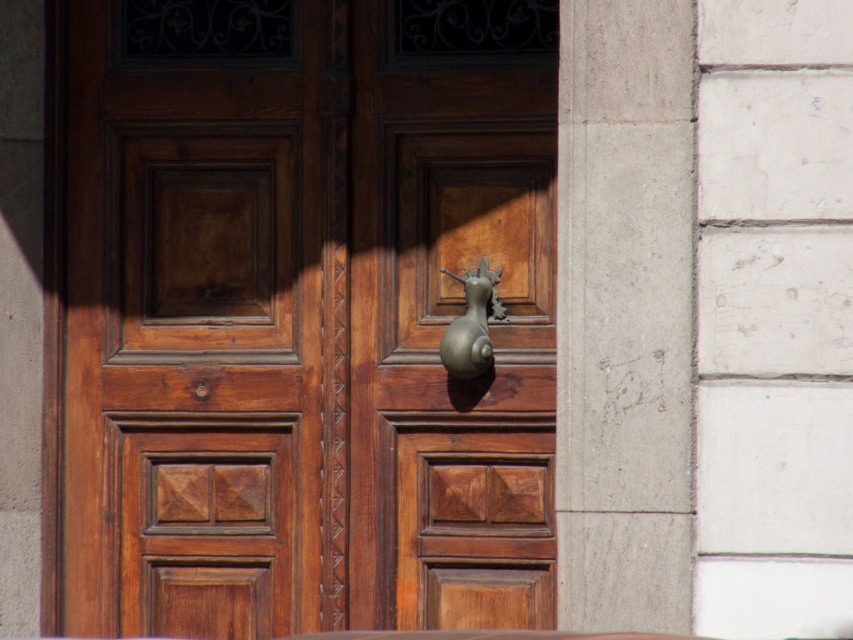
Which is behind, point (547, 202) or point (665, 531)?

The point (547, 202) is behind.

Is matte wood door at center taller than gray concrete pillar at center?

Yes.

What do you see at coordinates (305, 316) in the screenshot? This screenshot has height=640, width=853. I see `matte wood door at center` at bounding box center [305, 316].

The width and height of the screenshot is (853, 640). I want to click on matte wood door at center, so click(305, 316).

Is matte wood door at center wider than bronze/golden metallic snail at center?

Yes.

Which is behind, point (514, 294) or point (440, 333)?

Point (514, 294)

Between point (546, 36) and point (480, 349), which one is positioned in front?

Point (480, 349) is more forward.

Locate an element on the screen. The height and width of the screenshot is (640, 853). matte wood door at center is located at coordinates (305, 316).

Is point (635, 621) positioned before point (461, 376)?

Yes.

Does gray concrete pillar at center have a lesser height compared to bronze/golden metallic snail at center?

In fact, gray concrete pillar at center may be taller than bronze/golden metallic snail at center.

At what (x,y) coordinates should I click in order to perform the action: click on gray concrete pillar at center. Please return your answer as a coordinate pair (x, y). Looking at the image, I should click on pos(624,314).